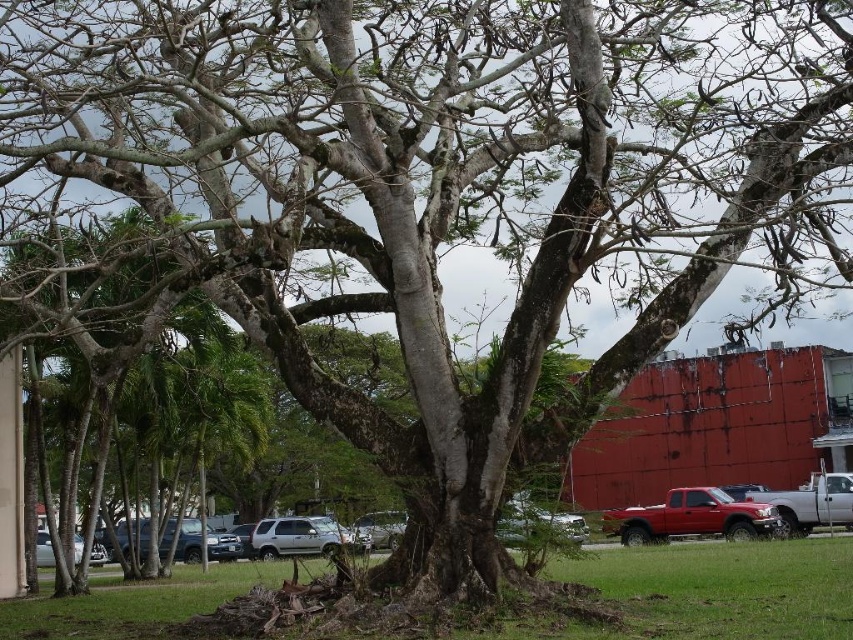
Question: Estimate the real-world distances between objects in this image. Which object is farther from the green grass at center?

Choices:
 (A) satin silver sedan at lower center
 (B) silver metallic car at lower left
 (C) shiny red truck at lower right
 (D) silver metallic suv at center

Answer: (B)

Question: Observing the image, what is the correct spatial positioning of shiny red truck at lower right in reference to silver metallic sedan at center?

Choices:
 (A) left
 (B) right

Answer: (B)

Question: Can you confirm if shiny red truck at lower right is positioned to the right of silver metallic car at lower left?

Choices:
 (A) yes
 (B) no

Answer: (A)

Question: Which point is farther from the camera taking this photo?

Choices:
 (A) (514, 541)
 (B) (231, 589)

Answer: (B)

Question: Considering the real-world distances, which object is farthest from the silver metallic sedan at center?

Choices:
 (A) shiny red truck at lower right
 (B) green grass at center
 (C) silver metallic suv at center
 (D) silver metallic car at lower left

Answer: (D)

Question: Is silver metallic suv at center positioned at the back of silver metallic car at lower left?

Choices:
 (A) no
 (B) yes

Answer: (A)